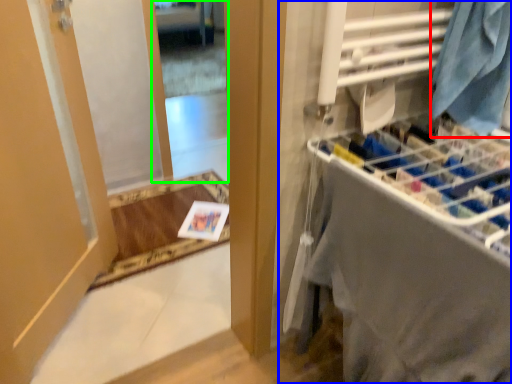
Question: Which object is positioned closest to clothing (highlighted by a red box)? Select from closet (highlighted by a blue box) and mirror (highlighted by a green box).

Choices:
 (A) closet
 (B) mirror

Answer: (A)